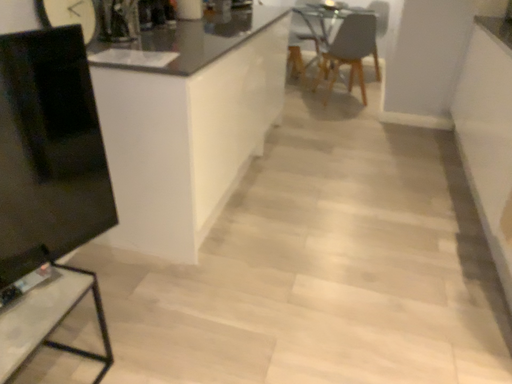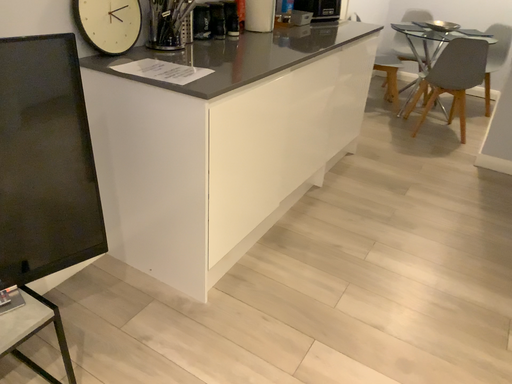
Question: How did the camera likely rotate when shooting the video?

Choices:
 (A) rotated left
 (B) rotated right

Answer: (A)